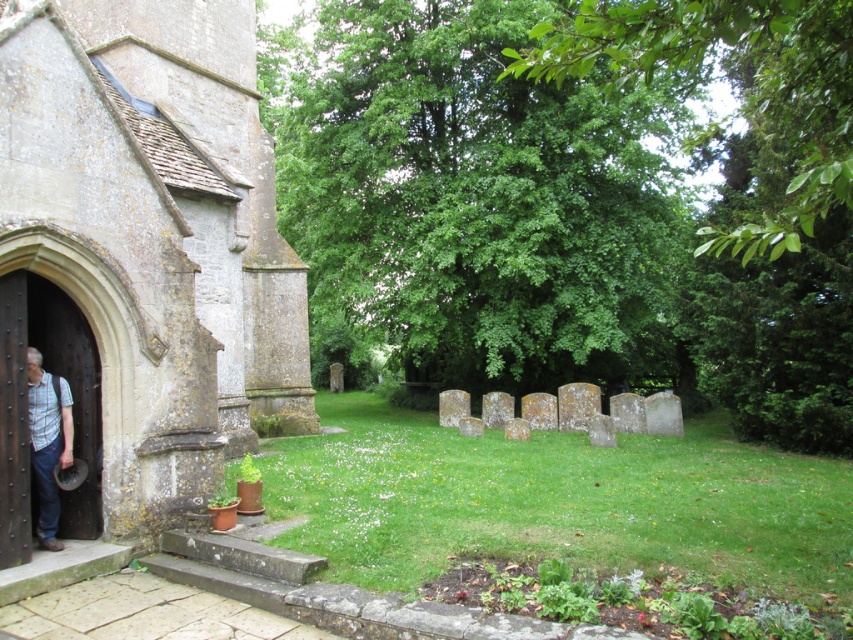
Question: Is stone church at left positioned at the back of dark brown wooden door at left?

Choices:
 (A) no
 (B) yes

Answer: (A)

Question: Can you confirm if stone church at left is positioned above dark brown wooden door at left?

Choices:
 (A) yes
 (B) no

Answer: (A)

Question: Is wooden door at left positioned behind dark brown wooden door at left?

Choices:
 (A) yes
 (B) no

Answer: (A)

Question: Which point is farther to the camera?

Choices:
 (A) (27, 506)
 (B) (54, 460)
 (C) (86, 404)

Answer: (C)

Question: Considering the real-world distances, which object is closest to the dark brown wooden door at left?

Choices:
 (A) plaid shirt at left
 (B) wooden door at left
 (C) stone church at left

Answer: (A)

Question: Which is nearer to the plaid shirt at left?

Choices:
 (A) wooden door at left
 (B) stone church at left
 (C) dark brown wooden door at left

Answer: (A)